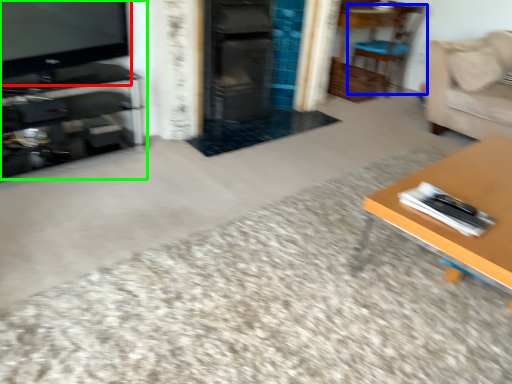
Question: Which object is positioned farthest from television (highlighted by a red box)? Select from chair (highlighted by a blue box) and entertainment center (highlighted by a green box).

Choices:
 (A) chair
 (B) entertainment center

Answer: (A)